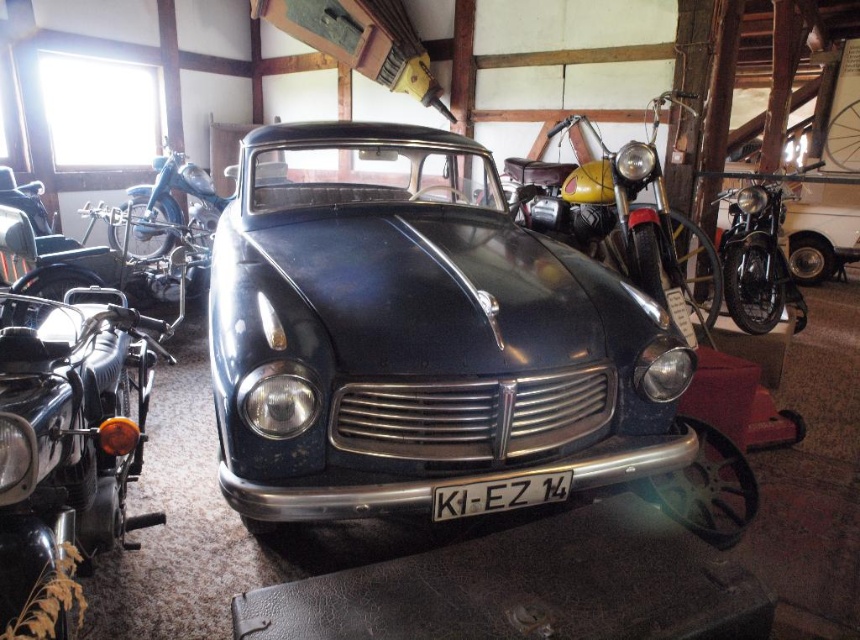
You are a photographer standing next to the camera. You want to take a photo of the yellow matte motorcycle at center. Is the distance between you and the motorcycle sufficient to capture the entire motorcycle in a single frame using a standard lens? Assume the standard lens has a focal length of 50mm and the camera sensor size is 36mm x 24mm. The motorcycle is 2.4 meters in length.

The distance between the yellow matte motorcycle at center and the camera is 3.66 meters. To determine if the motorcycle fits in the frame, calculate the angle of view. With a 50mm lens on a full frame sensor, the horizontal angle of view is approximately 46 degrees. Using trigonometry, the maximum distance to capture a 2.4m object would be roughly 2.4m divided by tan 23 degrees, which is approximately 5.8 meters. Since 3.66 meters is less than 5.8 meters, the motorcycle will fit within the frame.

From the picture: You are a photographer standing in front of the glossy dark blue car at center and the yellow matte motorcycle at center. You want to take a photo that focuses on the motorcycle while keeping the car in the background. Is the current arrangement suitable for this purpose?

The glossy dark blue car at center is closer to the viewer than the yellow matte motorcycle at center, so the current arrangement is suitable for taking a photo that focuses on the motorcycle while keeping the car in the background because the car will naturally appear smaller and less prominent in the background.

You are standing in front of the vintage car and want to locate two specific points marked on the car. The first point is at coordinate point (624, 400) and the second is at point (661, 173). Which of these two points is closer to the front of the car?

Point (624, 400) is in front of point (661, 173), so the first point is closer to the front of the car.